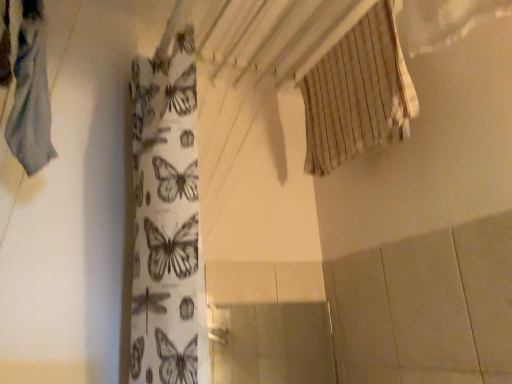
What do you see at coordinates (358, 94) in the screenshot? The height and width of the screenshot is (384, 512). I see `brown striped fabric at upper right` at bounding box center [358, 94].

Find the location of a particular element. This screenshot has height=384, width=512. brown striped fabric at upper right is located at coordinates (358, 94).

What is the approximate height of brown striped fabric at upper right?

brown striped fabric at upper right is 16.96 inches in height.

At what (x,y) coordinates should I click in order to perform the action: click on brown striped fabric at upper right. Please return your answer as a coordinate pair (x, y). The width and height of the screenshot is (512, 384). Looking at the image, I should click on (358, 94).